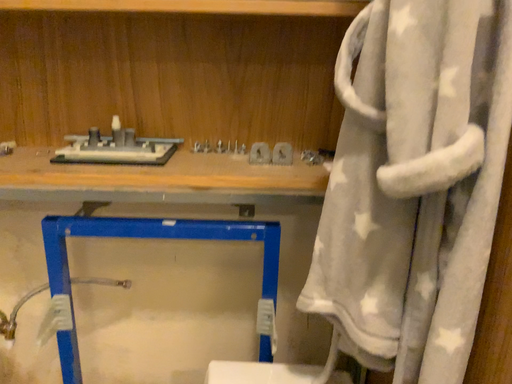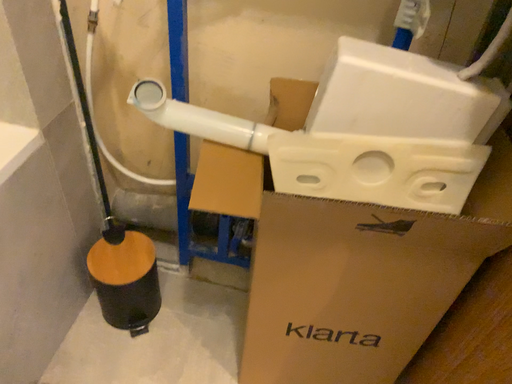
Question: How did the camera likely rotate when shooting the video?

Choices:
 (A) rotated upward
 (B) rotated downward

Answer: (B)